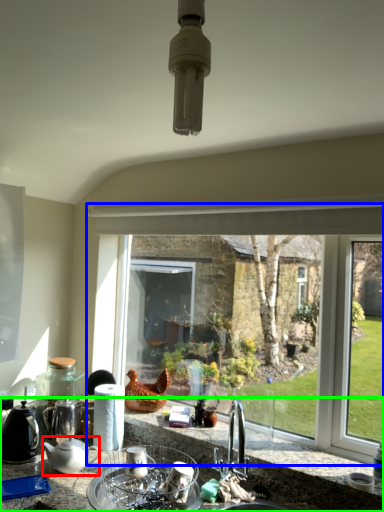
Question: Considering the real-world distances, which object is farthest from kitchen appliance (highlighted by a red box)? window (highlighted by a blue box) or countertop (highlighted by a green box)?

Choices:
 (A) window
 (B) countertop

Answer: (A)